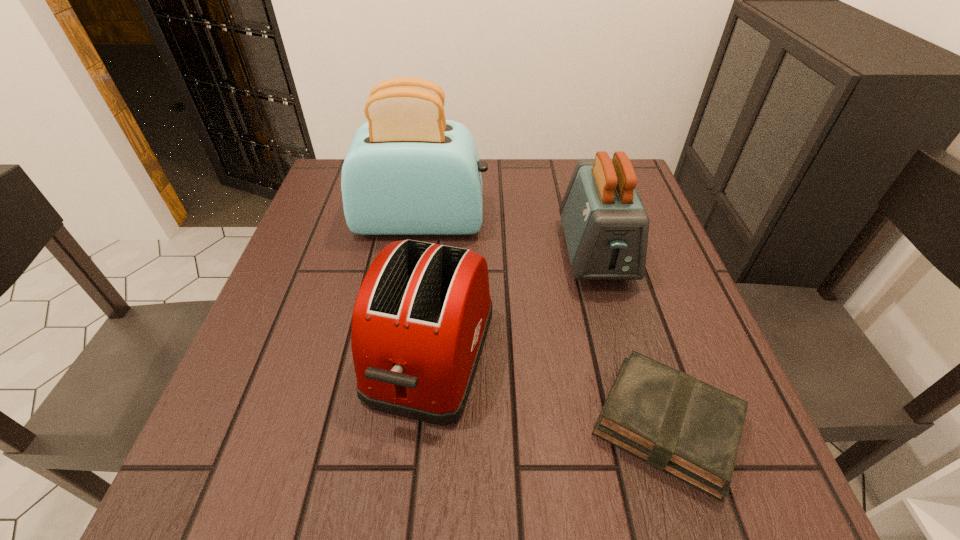
Identify the location of the closest toaster to the nearest toaster. (409, 171).

Where is `blank space that satisfies the following two spatial constraints: 1. on the side of the tallest object with the lever; 2. on the back side of the nearest toaster`? blank space that satisfies the following two spatial constraints: 1. on the side of the tallest object with the lever; 2. on the back side of the nearest toaster is located at coordinates tap(401, 355).

Identify the location of free location that satisfies the following two spatial constraints: 1. on the side of the tallest object with the lever; 2. on the left side of the nearest toaster. (401, 355).

Locate an element on the screen. vacant space that satisfies the following two spatial constraints: 1. on the front-facing side of the rightmost toaster; 2. on the right side of the shortest object is located at coordinates (643, 424).

Locate an element on the screen. The width and height of the screenshot is (960, 540). free space that satisfies the following two spatial constraints: 1. on the front-facing side of the rightmost toaster; 2. on the right side of the book is located at coordinates (643, 424).

I want to click on free location that satisfies the following two spatial constraints: 1. on the side of the tallest object with the lever; 2. on the back side of the nearest toaster, so click(401, 355).

This screenshot has width=960, height=540. In order to click on blank area in the image that satisfies the following two spatial constraints: 1. on the side of the tallest toaster with the lever; 2. on the right side of the book in this screenshot , I will do `click(391, 424)`.